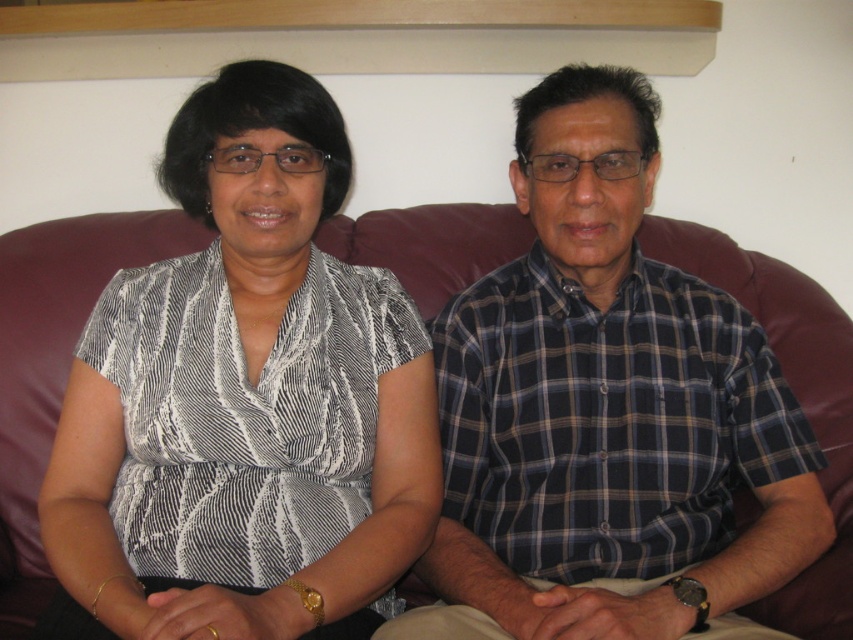
Question: Based on their relative distances, which object is nearer to the plaid cotton shirt at center?

Choices:
 (A) leather couch at center
 (B) matte black blouse at left

Answer: (B)

Question: Is matte black blouse at left below plaid cotton shirt at center?

Choices:
 (A) yes
 (B) no

Answer: (B)

Question: Is plaid cotton shirt at center smaller than leather couch at center?

Choices:
 (A) no
 (B) yes

Answer: (B)

Question: Is plaid cotton shirt at center thinner than leather couch at center?

Choices:
 (A) yes
 (B) no

Answer: (A)

Question: Which object is farther from the camera taking this photo?

Choices:
 (A) leather couch at center
 (B) plaid cotton shirt at center
 (C) matte black blouse at left

Answer: (A)

Question: Which point appears farthest from the camera in this image?

Choices:
 (A) (202, 593)
 (B) (827, 390)
 (C) (733, 634)

Answer: (B)